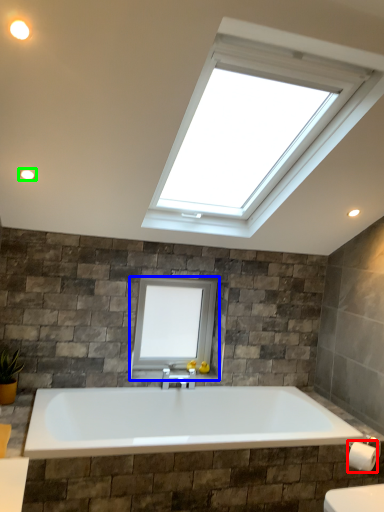
Question: Based on their relative distances, which object is nearer to toilet paper (highlighted by a red box)? Choose from window (highlighted by a blue box) and light fixture (highlighted by a green box).

Choices:
 (A) window
 (B) light fixture

Answer: (A)